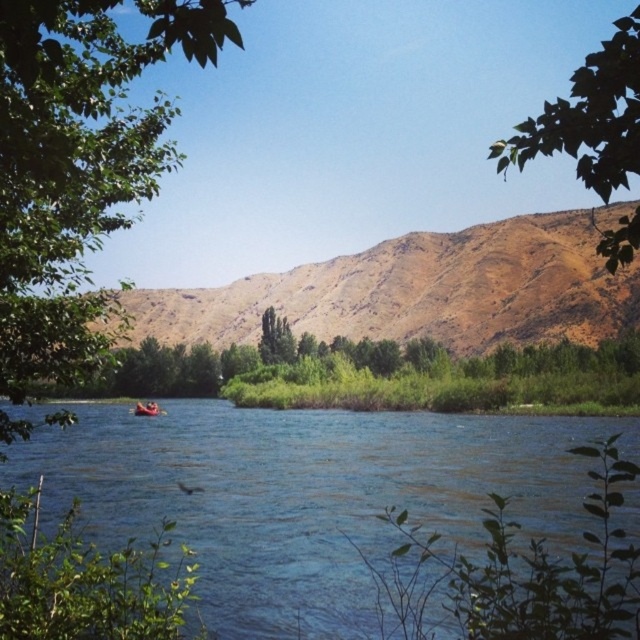
Is point (632, 337) closer to viewer compared to point (154, 412)?

Yes, point (632, 337) is in front of point (154, 412).

The height and width of the screenshot is (640, 640). What are the coordinates of `green leafy tree at center` in the screenshot? It's located at (371, 369).

Between point (100, 385) and point (136, 412), which one is positioned behind?

The point (100, 385) is more distant.

Locate an element on the screen. The width and height of the screenshot is (640, 640). green leafy tree at center is located at coordinates (371, 369).

Is green leafy tree at upper right above rubber boat at center?

Yes.

Describe the element at coordinates (589, 116) in the screenshot. The image size is (640, 640). I see `green leafy tree at upper right` at that location.

Between point (612, 68) and point (140, 403), which one is positioned in front?

Point (612, 68) is more forward.

Where is `green leafy tree at upper right`? The height and width of the screenshot is (640, 640). green leafy tree at upper right is located at coordinates (589, 116).

Is the position of blue water at center less distant than that of green leafy tree at center?

No, blue water at center is further to the viewer.

Can you confirm if blue water at center is taller than green leafy tree at center?

In fact, blue water at center may be shorter than green leafy tree at center.

Image resolution: width=640 pixels, height=640 pixels. Describe the element at coordinates (308, 496) in the screenshot. I see `blue water at center` at that location.

Locate an element on the screen. The height and width of the screenshot is (640, 640). blue water at center is located at coordinates (308, 496).